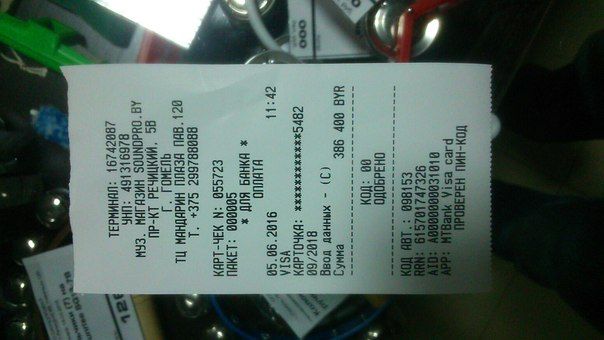
Find the location of a particular element. light is located at coordinates (165, 10).